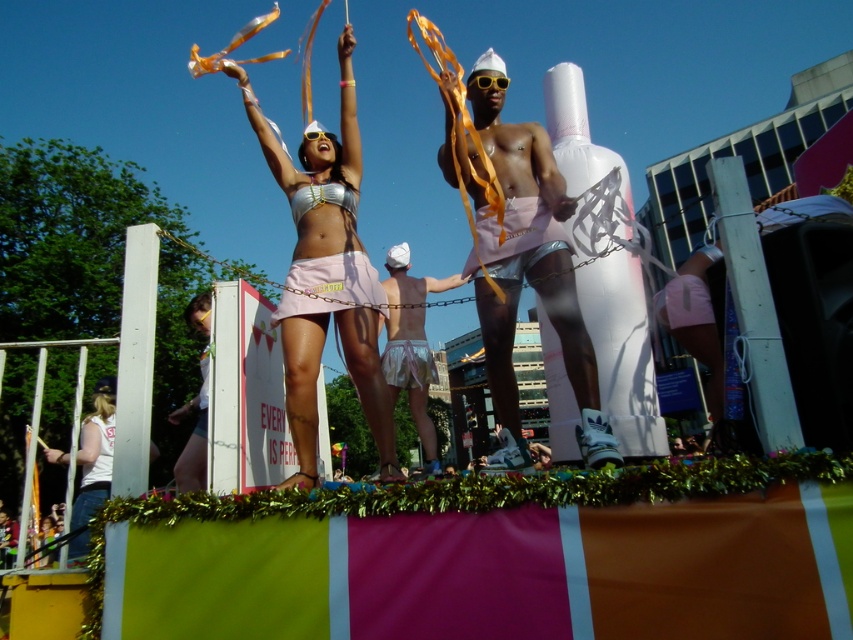
Question: Can you confirm if white satin shorts at center is positioned above metallic silver bikini top at center?

Choices:
 (A) no
 (B) yes

Answer: (A)

Question: Based on their relative distances, which object is farther from the pink satin panties at center?

Choices:
 (A) white matte inflatable at center
 (B) pink satin skirt at center
 (C) shiny silver bikini top at center
 (D) metallic silver bikini top at center

Answer: (D)

Question: Which point appears closest to the camera in this image?

Choices:
 (A) (305, 308)
 (B) (424, 419)
 (C) (412, 378)

Answer: (A)

Question: Which point is farther from the camera taking this photo?

Choices:
 (A) (328, 200)
 (B) (347, 310)
 (C) (288, 285)

Answer: (A)

Question: Does shiny silver bikini top at center have a smaller size compared to white cotton shirt at lower left?

Choices:
 (A) no
 (B) yes

Answer: (A)

Question: Is shiny silver bikini top at center smaller than metallic silver bikini top at center?

Choices:
 (A) no
 (B) yes

Answer: (A)